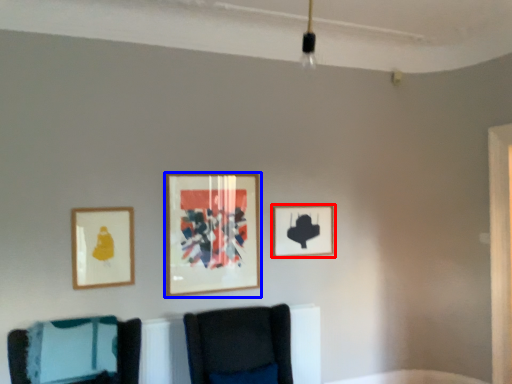
Question: Which point is closer to the camera, picture frame (highlighted by a red box) or picture frame (highlighted by a blue box)?

Choices:
 (A) picture frame
 (B) picture frame

Answer: (B)